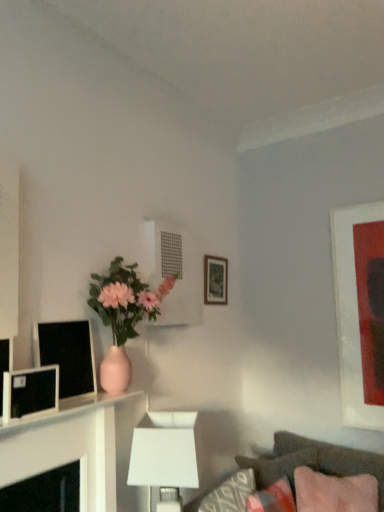
Question: Is matte black monitor at left, which ranks as the 1th computer monitor in back-to-front order, inside the boundaries of matte wooden picture frame at center, which is the 2th picture frame from front to back, or outside?

Choices:
 (A) outside
 (B) inside

Answer: (A)

Question: From the image's perspective, is matte black monitor at left, which ranks as the 1th computer monitor in back-to-front order, above or below matte wooden picture frame at center, the 1th picture frame positioned from the left?

Choices:
 (A) above
 (B) below

Answer: (B)

Question: Which object is positioned farthest from the pink fabric pillow at lower right, which ranks as the 2th pillow in back-to-front order?

Choices:
 (A) matte white picture frame at right, arranged as the 2th picture frame when viewed from the back
 (B) pink fabric pillow at lower right, acting as the first pillow starting from the back
 (C) white glossy table at upper left
 (D) matte pink vase at center
 (E) matte black monitor at left, the second computer monitor viewed from the back

Answer: (E)

Question: Which object is the closest to the pink fabric pillow at lower right, the 2th pillow viewed from the front?

Choices:
 (A) matte black monitor at left, the second computer monitor in the front-to-back sequence
 (B) velvet brown couch at lower right
 (C) matte black monitor at left, the second computer monitor viewed from the back
 (D) pink fabric pillow at lower right, which ranks as the 2th pillow in back-to-front order
 (E) matte pink vase at center

Answer: (B)